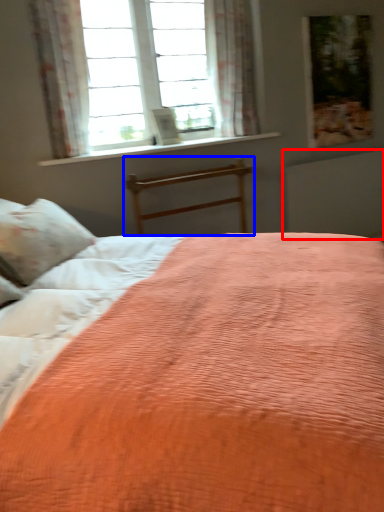
Question: Which of the following is the farthest to the observer, radiator (highlighted by a red box) or bed frame (highlighted by a blue box)?

Choices:
 (A) radiator
 (B) bed frame

Answer: (A)